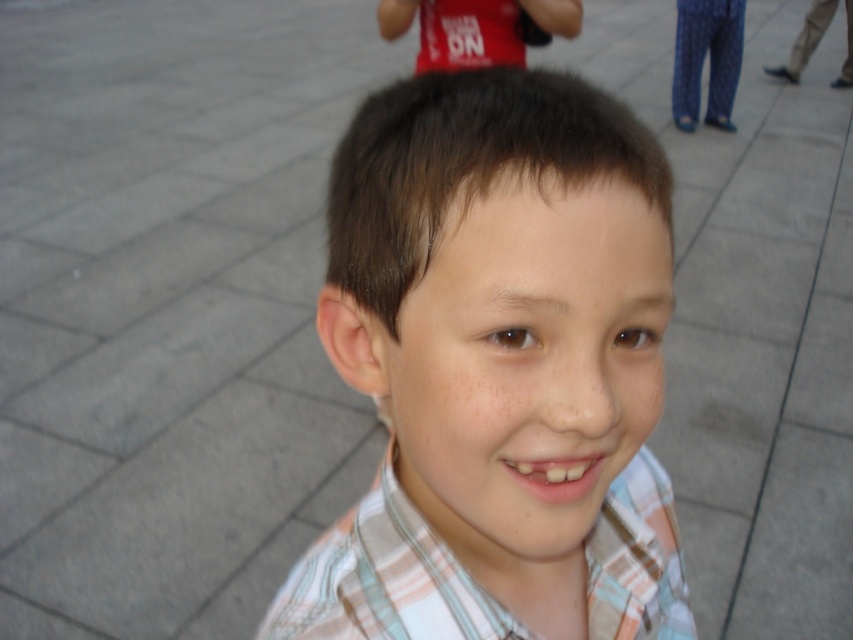
Question: Based on their relative distances, which object is nearer to the matte red shirt at upper center?

Choices:
 (A) plaid cotton shirt at center
 (B) plaid shirt at center

Answer: (A)

Question: Does plaid cotton shirt at center appear on the right side of matte red shirt at upper center?

Choices:
 (A) yes
 (B) no

Answer: (B)

Question: Which object is positioned farthest from the matte red shirt at upper center?

Choices:
 (A) plaid cotton shirt at center
 (B) plaid shirt at center

Answer: (B)

Question: Can you confirm if plaid shirt at center is wider than plaid cotton shirt at center?

Choices:
 (A) no
 (B) yes

Answer: (B)

Question: Considering the relative positions of plaid shirt at center and matte red shirt at upper center in the image provided, where is plaid shirt at center located with respect to matte red shirt at upper center?

Choices:
 (A) left
 (B) right

Answer: (A)

Question: Estimate the real-world distances between objects in this image. Which object is closer to the matte red shirt at upper center?

Choices:
 (A) plaid shirt at center
 (B) plaid cotton shirt at center

Answer: (B)